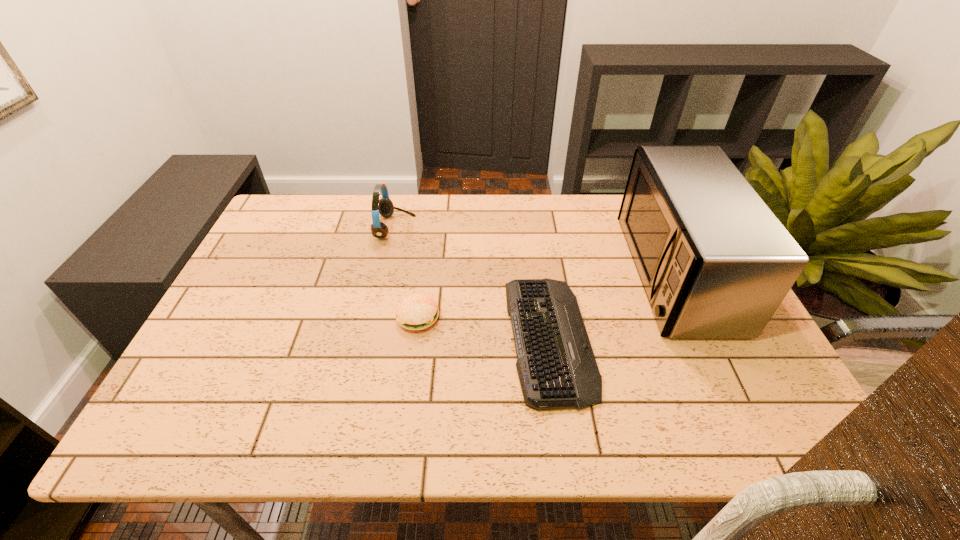
The height and width of the screenshot is (540, 960). In order to click on the rightmost object in this screenshot , I will do `click(715, 262)`.

Locate an element on the screen. microwave_oven is located at coordinates (x=715, y=262).

Find the location of a particular element. the second tallest object is located at coordinates (384, 206).

The width and height of the screenshot is (960, 540). I want to click on patty, so click(x=417, y=311).

Where is `the shortest object`? the shortest object is located at coordinates pyautogui.click(x=556, y=366).

What are the coordinates of `the second object from right to left` in the screenshot? It's located at (556, 366).

You are a GUI agent. You are given a task and a screenshot of the screen. Output one action in this format:
    pyautogui.click(x=<x>, y=<y>)
    Task: Click on the vacant region located on the front-facing side of the tallest object
    Image resolution: width=960 pixels, height=540 pixels.
    Given the screenshot: What is the action you would take?
    pyautogui.click(x=545, y=272)

At what (x,y) coordinates should I click in order to perform the action: click on free point located on the front-facing side of the tallest object. Please return your answer as a coordinate pair (x, y). The width and height of the screenshot is (960, 540). Looking at the image, I should click on (553, 272).

The width and height of the screenshot is (960, 540). I want to click on free spot located on the front-facing side of the tallest object, so click(489, 272).

Find the location of a particular element. Image resolution: width=960 pixels, height=540 pixels. vacant space located with the microphone attached to the side of the headset is located at coordinates (530, 228).